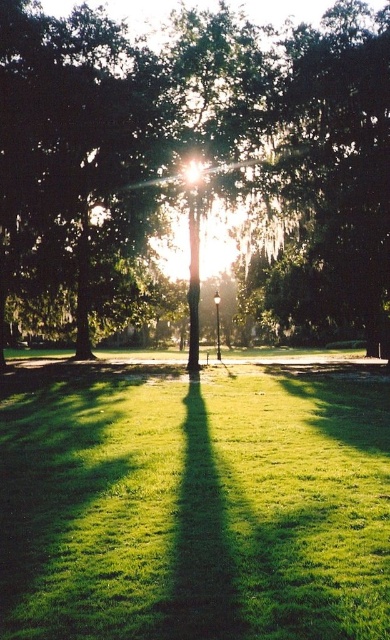
You are standing in the park and see two points marked in the image. Which point is closer to you, point (47, 115) or point (326, 609)?

Point (47, 115) is closer to you because it is further to the viewer than point (326, 609).

You are a gardener planning to plant a new flower bed between the green leafy tree at center and the green grassy at center. Considering their sizes, which area would you choose for the flower bed to ensure it is more noticeable?

The green grassy at center has a smaller size compared to the green leafy tree at center, so planting the flower bed there would make it more noticeable against the smaller area.

You are standing in the park and want to find the green leafy tree at center. Based on the coordinates given, where would you look relative to the lamppost?

The green leafy tree at center is located at coordinates point (189, 154), which places it to the left and slightly forward of the lamppost.